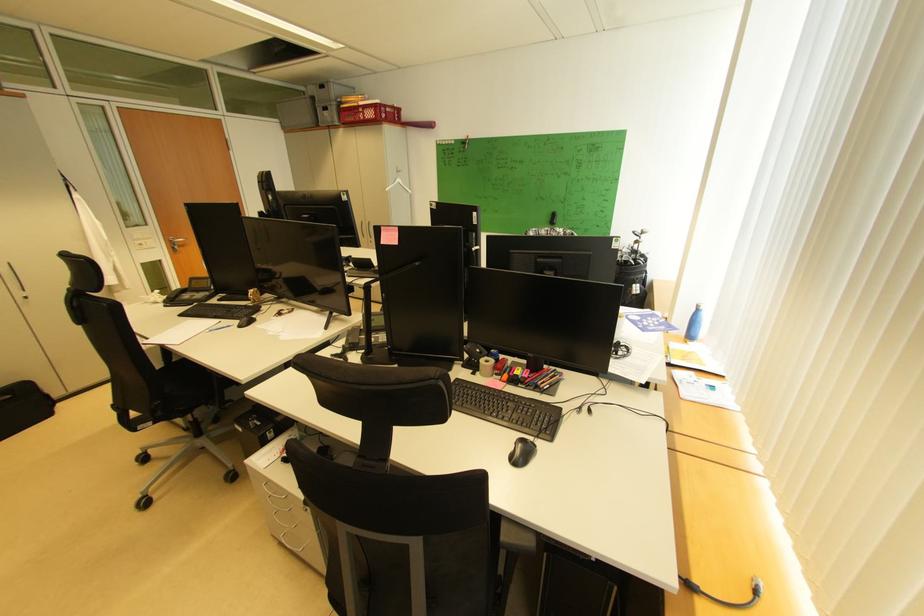
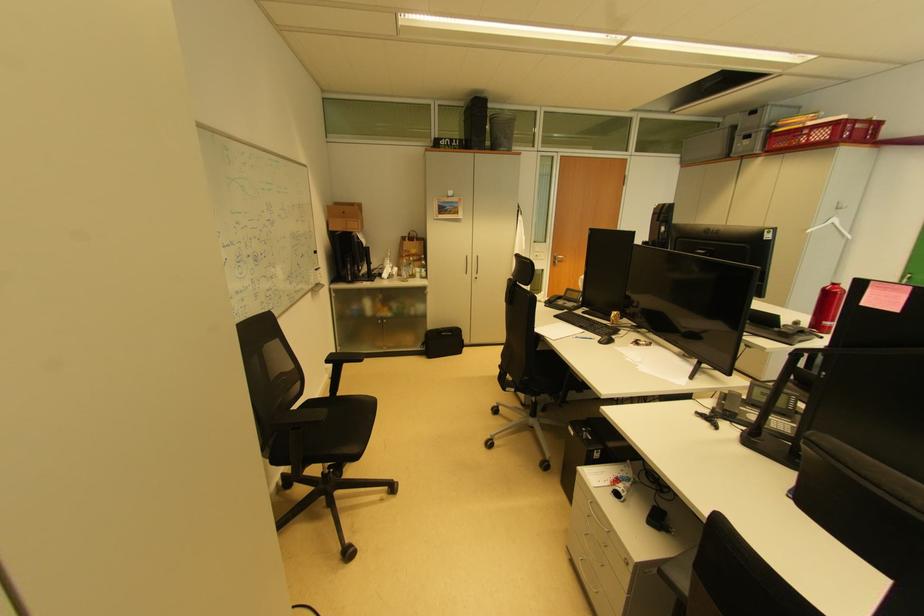
Question: How did the camera likely rotate?

Choices:
 (A) Left
 (B) Right
 (C) Up
 (D) Down

Answer: (A)